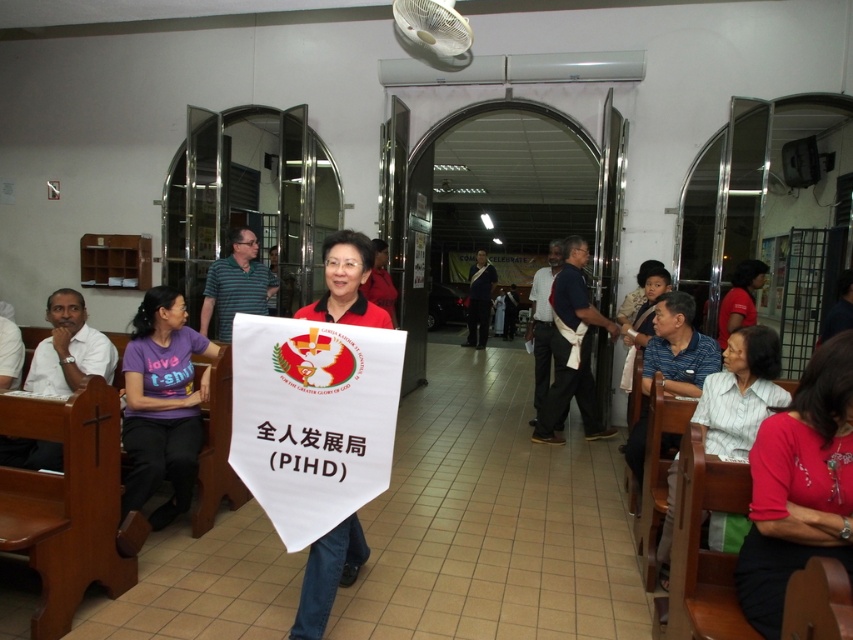
You are a photographer standing at the back of the room. You want to take a photo of the red matte banner at center and the matte red blouse at lower right. The camera you are using has a minimum focus distance of 5 feet. Will both subjects be in focus if you position yourself at the specified distance?

The matte red blouse at lower right is only 4.33 feet away from the red matte banner at center. Since the camera requires a minimum focus distance of 5 feet to focus on both subjects simultaneously, positioning yourself at this distance would mean the camera cannot focus on both the matte red blouse at lower right and the red matte banner at center at the same time.

You are standing at the entrance of the room. There is a matte red blouse at lower right and a banner with the text

The distance between the matte red blouse at lower right and the banner with the text